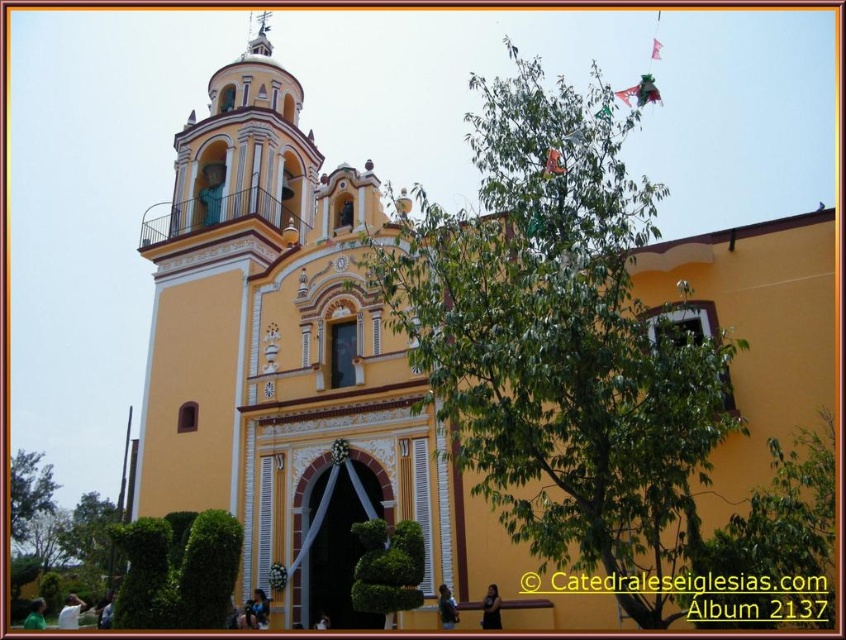
Measure the distance between green leafy tree at lower left and smooth white spire at upper center.

green leafy tree at lower left and smooth white spire at upper center are 72.49 meters apart from each other.

Does green leafy tree at lower left have a smaller size compared to smooth white spire at upper center?

Yes.

Find the location of `green leafy tree at lower left`. green leafy tree at lower left is located at coordinates (29, 492).

Locate an element on the screen. green leafy tree at lower left is located at coordinates (29, 492).